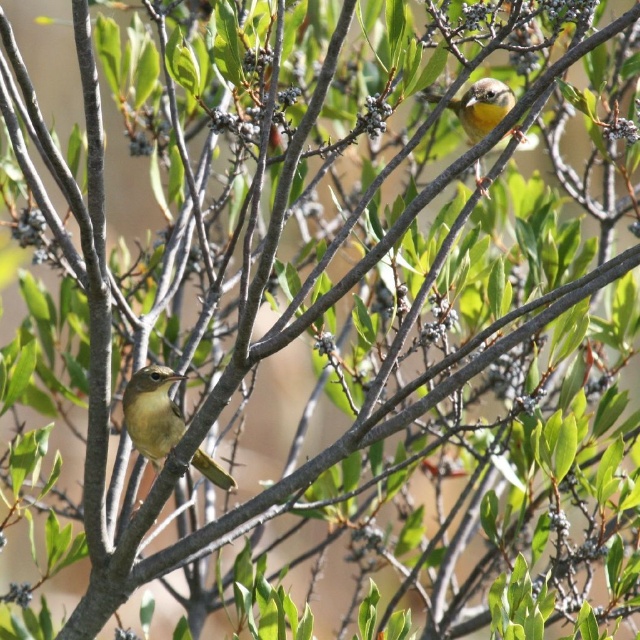
Question: Is green matte bird at center above yellowish-green feathers at upper right?

Choices:
 (A) yes
 (B) no

Answer: (B)

Question: Which point is farther to the camera?

Choices:
 (A) (468, 88)
 (B) (164, 385)

Answer: (A)

Question: Can you confirm if green matte bird at center is wider than yellowish-green feathers at upper right?

Choices:
 (A) no
 (B) yes

Answer: (B)

Question: Which point is closer to the camera taking this photo?

Choices:
 (A) (481, 120)
 (B) (216, 477)

Answer: (A)

Question: Is green matte bird at center thinner than yellowish-green feathers at upper right?

Choices:
 (A) no
 (B) yes

Answer: (A)